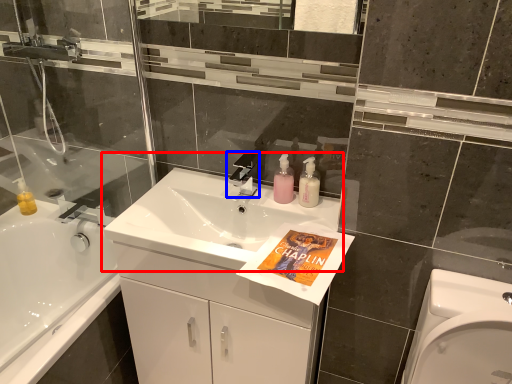
Question: Which point is closer to the camera, sink (highlighted by a red box) or tap (highlighted by a blue box)?

Choices:
 (A) sink
 (B) tap

Answer: (A)